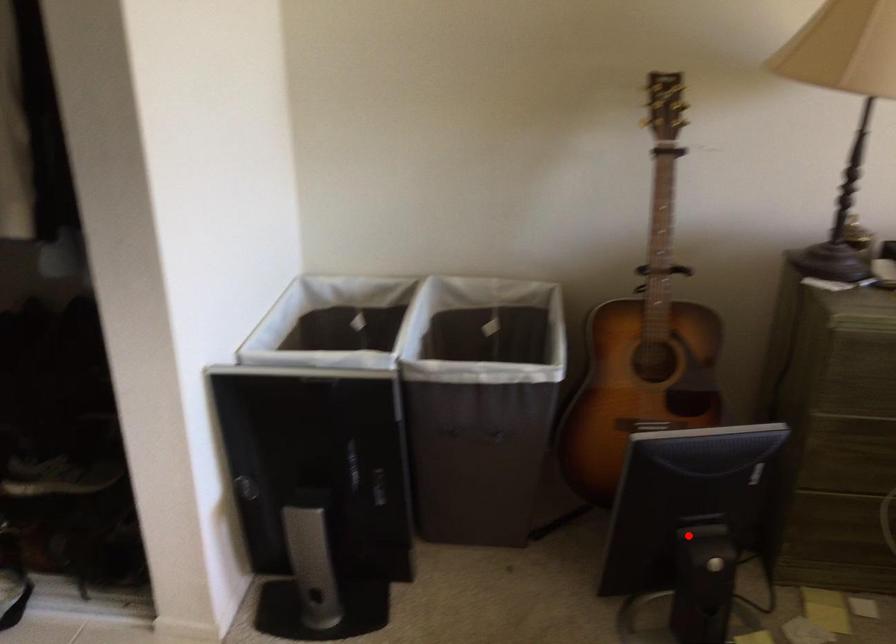
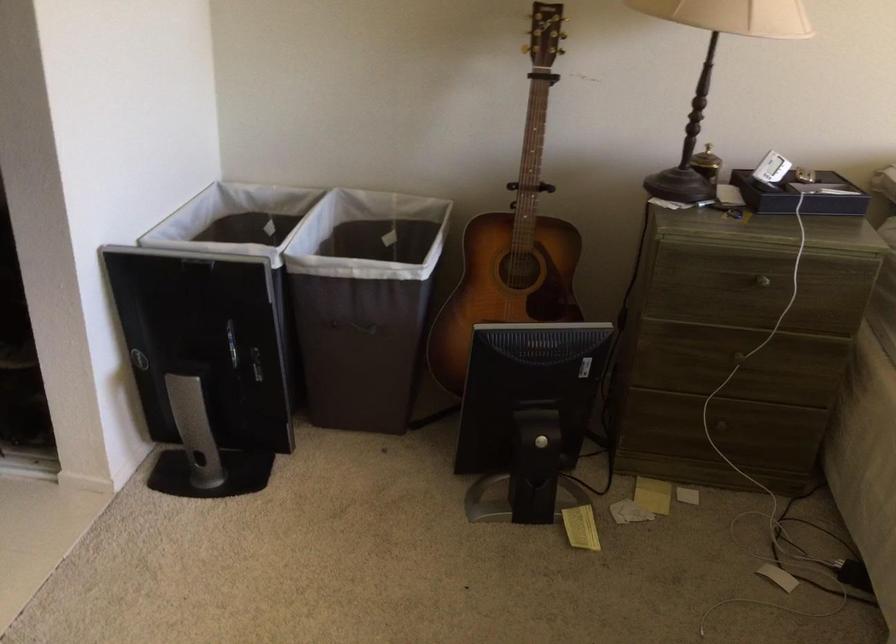
Find the pixel in the second image that matches the highlighted location in the first image.

(528, 415)